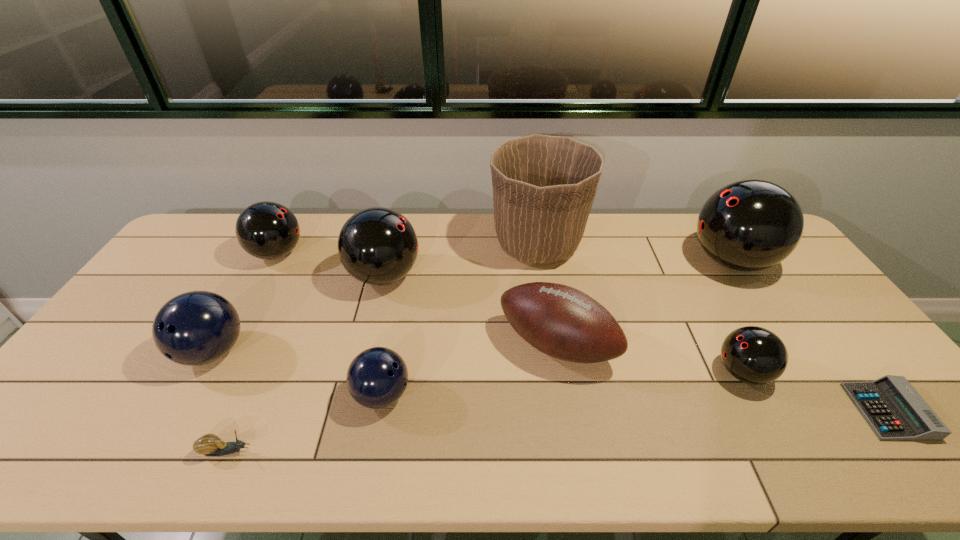
Identify the location of the ninth tallest object. This screenshot has height=540, width=960. (209, 444).

The height and width of the screenshot is (540, 960). I want to click on the nearest object, so click(209, 444).

Locate an element on the screen. This screenshot has width=960, height=540. gray calculator is located at coordinates (894, 410).

I want to click on calculator, so coord(894,410).

Find the location of `free space located 0.380m on the right of the flowerpot`. free space located 0.380m on the right of the flowerpot is located at coordinates (695, 244).

At what (x,y) coordinates should I click in order to perform the action: click on vacant position located on the surface of the ninth shortest object near the finger holes. Please return your answer as a coordinate pair (x, y). Looking at the image, I should click on (632, 261).

You are a GUI agent. You are given a task and a screenshot of the screen. Output one action in this format:
    pyautogui.click(x=<x>, y=<y>)
    Task: Click on the free location located on the surface of the ninth shortest object near the finger holes
    The height and width of the screenshot is (540, 960).
    Given the screenshot: What is the action you would take?
    pyautogui.click(x=637, y=261)

Where is `vacant space located on the surface of the ninth shortest object near the finger holes`? The image size is (960, 540). vacant space located on the surface of the ninth shortest object near the finger holes is located at coordinates (613, 261).

The width and height of the screenshot is (960, 540). Find the location of `vacant region located on the surface of the eighth shortest object near the finger holes`. vacant region located on the surface of the eighth shortest object near the finger holes is located at coordinates (455, 276).

The height and width of the screenshot is (540, 960). What are the coordinates of `free location located 0.300m on the surface of the second smallest black bowling ball near the finger holes` in the screenshot? It's located at (393, 254).